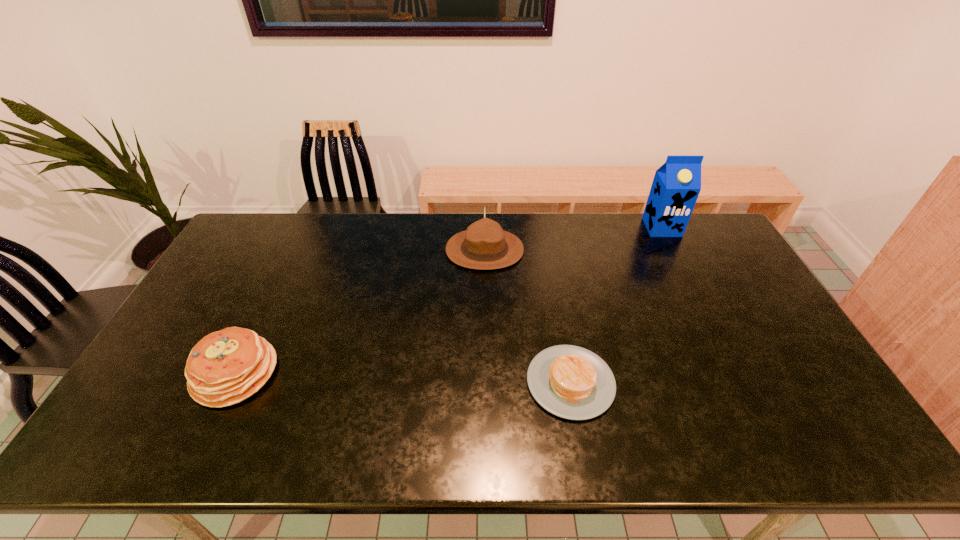
Identify the location of vacant region at the near edge of the desktop. (733, 431).

You are a GUI agent. You are given a task and a screenshot of the screen. Output one action in this format:
    pyautogui.click(x=<x>, y=<y>)
    Task: Click on the vacant region at the left edge of the desktop
    
    Given the screenshot: What is the action you would take?
    pyautogui.click(x=190, y=343)

In the image, there is a desktop. Identify the location of vacant space at the right edge. The height and width of the screenshot is (540, 960). (726, 313).

Identify the location of vacant region at the far right corner of the desktop. (695, 239).

Image resolution: width=960 pixels, height=540 pixels. Find the location of `vacant space in between the tallest object and the shortest object`. vacant space in between the tallest object and the shortest object is located at coordinates (616, 305).

At what (x,y) coordinates should I click in order to perform the action: click on free space between the fedora and the carton. Please return your answer as a coordinate pair (x, y). Looking at the image, I should click on (573, 239).

Identify the location of free area in between the fedora and the carton. The image size is (960, 540). (573, 239).

The image size is (960, 540). I want to click on free space between the taller pancake and the carton, so click(x=448, y=300).

Where is `vacant area that lies between the left pancake and the shortest object`? The width and height of the screenshot is (960, 540). vacant area that lies between the left pancake and the shortest object is located at coordinates (403, 377).

Image resolution: width=960 pixels, height=540 pixels. Find the location of `vacant area that lies between the fedora and the shortest object`. vacant area that lies between the fedora and the shortest object is located at coordinates (528, 316).